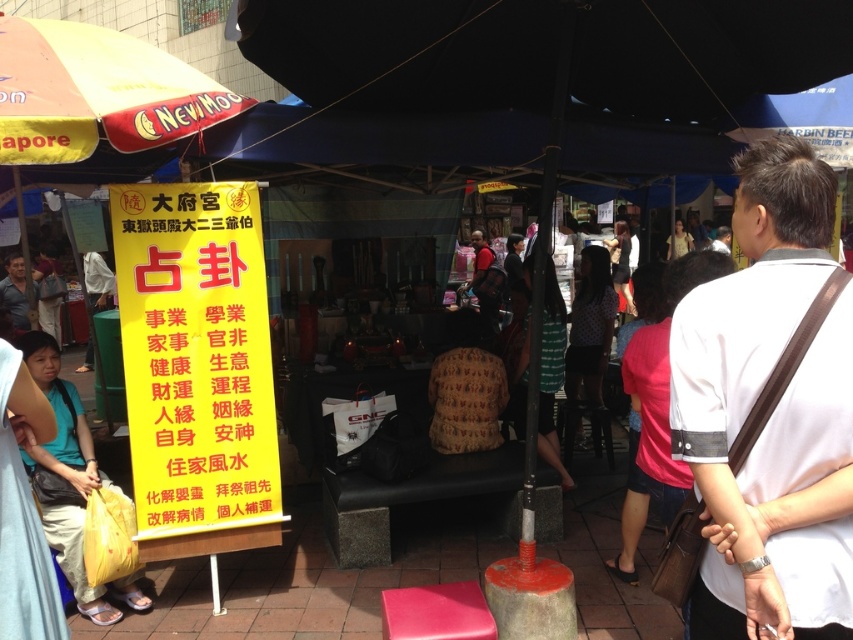
Question: Can you confirm if white fabric shirt at center is smaller than yellow paper sign at center?

Choices:
 (A) yes
 (B) no

Answer: (A)

Question: Which point is farther from the camera taking this photo?

Choices:
 (A) (213, 476)
 (B) (51, 458)
 (C) (755, 152)

Answer: (A)

Question: Which object is closer to the camera taking this photo?

Choices:
 (A) yellow paper sign at center
 (B) white fabric shirt at center
 (C) yellow plastic bag at lower left

Answer: (B)

Question: Which of the following is the closest to the observer?

Choices:
 (A) white fabric shirt at center
 (B) yellow plastic bag at lower left
 (C) yellow paper sign at center

Answer: (A)

Question: Is the position of white fabric shirt at center less distant than that of yellow paper sign at center?

Choices:
 (A) yes
 (B) no

Answer: (A)

Question: Can you confirm if white fabric shirt at center is thinner than yellow plastic bag at lower left?

Choices:
 (A) yes
 (B) no

Answer: (A)